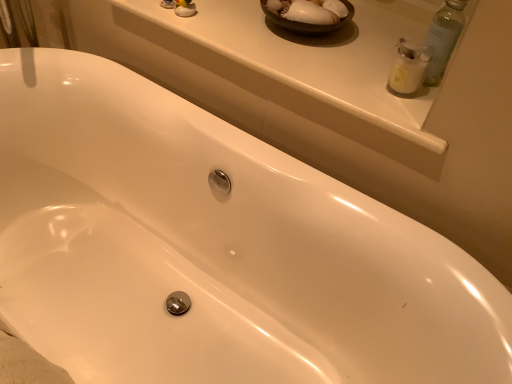
You are a GUI agent. You are given a task and a screenshot of the screen. Output one action in this format:
    pyautogui.click(x=<x>, y=<y>)
    Task: Click on the vacant area on top of white glossy window sill at upper center (from a real-world perspective)
    
    Given the screenshot: What is the action you would take?
    pyautogui.click(x=314, y=39)